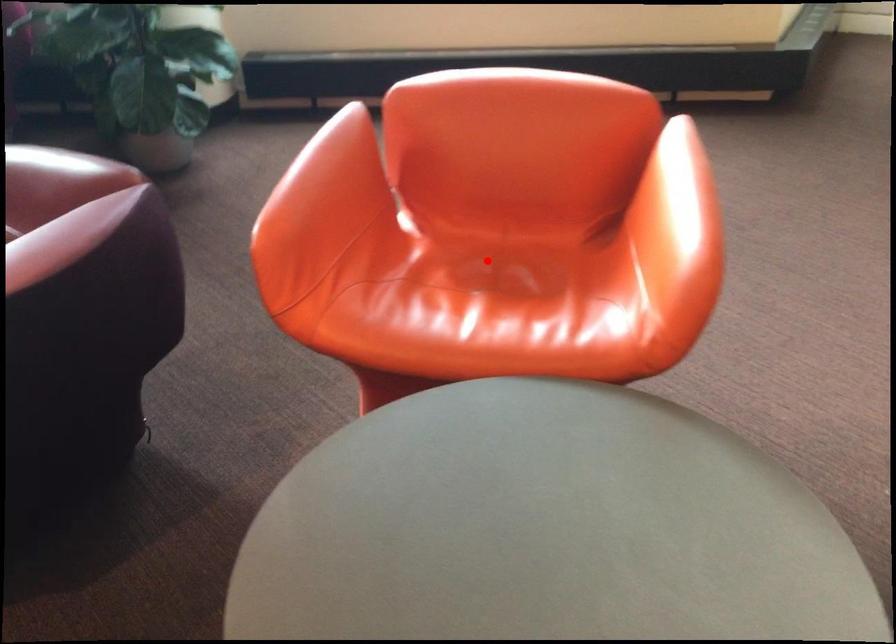
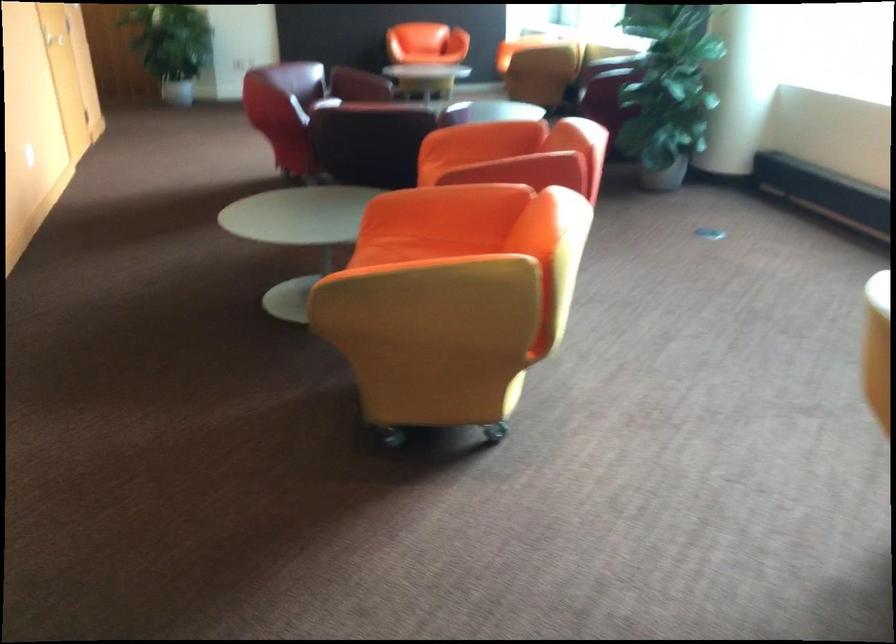
Question: I am providing you with two images of the same scene from different viewpoints. A red point is marked on the first image. At the location where the point appears in image 1, is it still visible in image 2?

Choices:
 (A) Yes
 (B) No

Answer: (B)